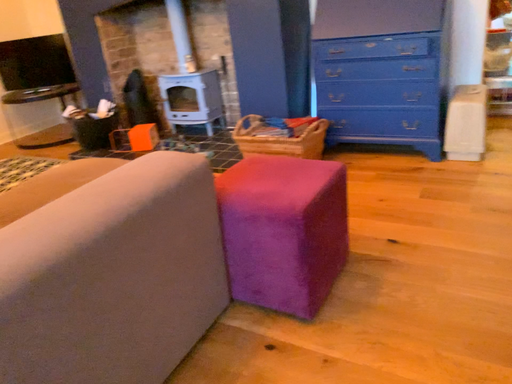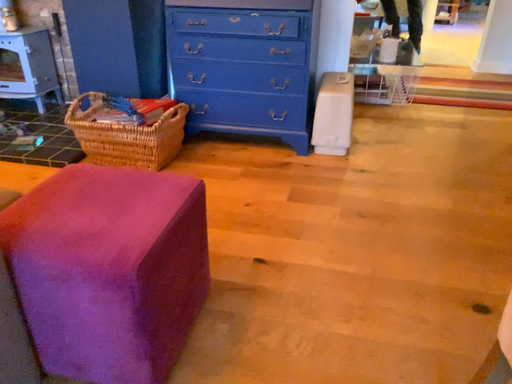
Question: Which way did the camera rotate in the video?

Choices:
 (A) rotated right
 (B) rotated left

Answer: (A)